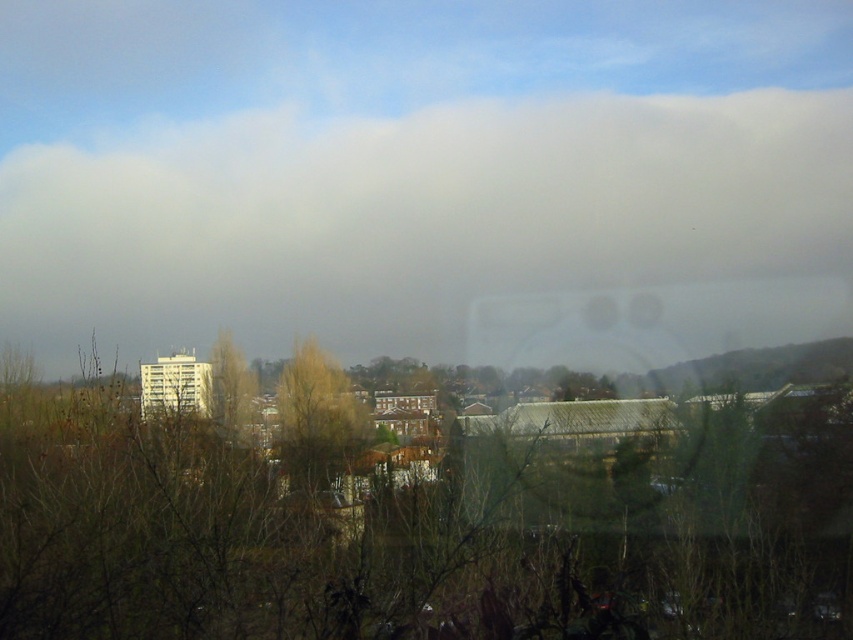
Is brown textured tree at center above green matte tree at center?

Actually, brown textured tree at center is below green matte tree at center.

Does point (291, 390) come behind point (245, 410)?

Yes, point (291, 390) is farther from viewer.

At what (x,y) coordinates should I click in order to perform the action: click on brown textured tree at center. Please return your answer as a coordinate pair (x, y). The width and height of the screenshot is (853, 640). Looking at the image, I should click on (316, 419).

Can you confirm if brown leafless tree at center is positioned below green matte tree at center?

Correct, brown leafless tree at center is located below green matte tree at center.

Between point (485, 460) and point (248, 397), which one is positioned in front?

Point (485, 460) is in front.

Which is in front, point (592, 560) or point (225, 346)?

Point (592, 560) is in front.

Locate an element on the screen. brown leafless tree at center is located at coordinates (422, 520).

Between point (792, 230) and point (229, 410), which one is positioned behind?

The point (229, 410) is behind.

Looking at this image, does white fluffy cloud at upper center lie in front of green matte tree at center?

Yes, it is in front of green matte tree at center.

Does point (80, 336) come in front of point (256, 408)?

Yes, point (80, 336) is in front of point (256, 408).

You are a GUI agent. You are given a task and a screenshot of the screen. Output one action in this format:
    pyautogui.click(x=<x>, y=<y>)
    Task: Click on the white fluffy cloud at upper center
    This screenshot has width=853, height=640.
    Given the screenshot: What is the action you would take?
    pyautogui.click(x=447, y=232)